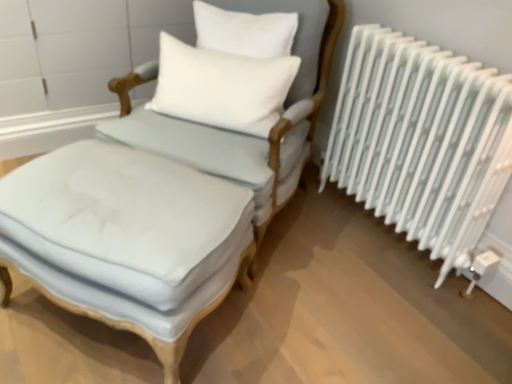
Locate an element on the screen. free space that is in between light blue fabric armchair at center and white metal radiator at right is located at coordinates (344, 258).